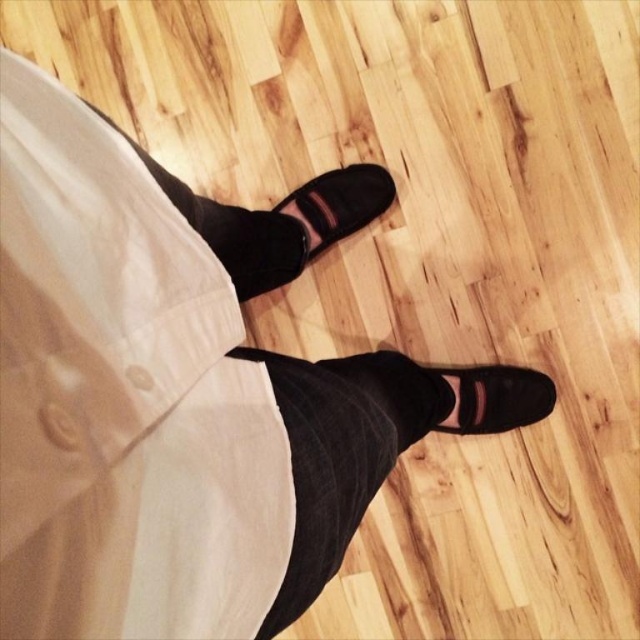
Question: Considering the real-world distances, which object is closest to the black suede pants at center?

Choices:
 (A) suede/black shoe at lower right
 (B) suede/black shoe at center

Answer: (A)

Question: Estimate the real-world distances between objects in this image. Which object is closer to the suede/black shoe at center?

Choices:
 (A) black suede pants at center
 (B) suede/black shoe at lower right

Answer: (B)

Question: Does black suede pants at center have a lesser width compared to suede/black shoe at lower right?

Choices:
 (A) yes
 (B) no

Answer: (B)

Question: Can you confirm if black suede pants at center is wider than suede/black shoe at lower right?

Choices:
 (A) yes
 (B) no

Answer: (A)

Question: Can you confirm if suede/black shoe at center is positioned to the left of suede/black shoe at lower right?

Choices:
 (A) yes
 (B) no

Answer: (A)

Question: Considering the real-world distances, which object is closest to the suede/black shoe at lower right?

Choices:
 (A) suede/black shoe at center
 (B) black suede pants at center

Answer: (B)